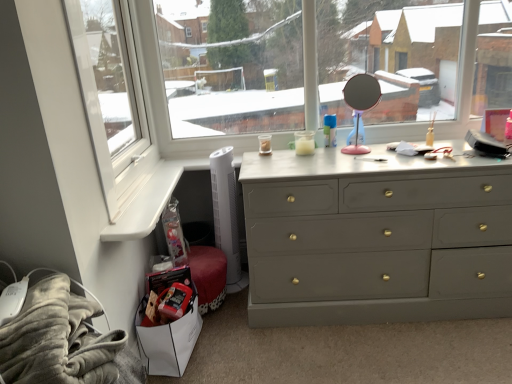
Question: Considering the relative sizes of matte gray dresser at center and fuzzy gray blanket at lower left in the image provided, is matte gray dresser at center shorter than fuzzy gray blanket at lower left?

Choices:
 (A) yes
 (B) no

Answer: (B)

Question: Is the depth of matte gray dresser at center greater than that of fuzzy gray blanket at lower left?

Choices:
 (A) yes
 (B) no

Answer: (A)

Question: From the image's perspective, is matte gray dresser at center over fuzzy gray blanket at lower left?

Choices:
 (A) no
 (B) yes

Answer: (B)

Question: Can we say matte gray dresser at center lies outside fuzzy gray blanket at lower left?

Choices:
 (A) yes
 (B) no

Answer: (A)

Question: Is matte gray dresser at center in contact with fuzzy gray blanket at lower left?

Choices:
 (A) yes
 (B) no

Answer: (B)

Question: Looking at the image, does matte gray dresser at center seem bigger or smaller compared to pink plastic mirror at upper center?

Choices:
 (A) big
 (B) small

Answer: (A)

Question: Does point (375, 256) appear closer or farther from the camera than point (380, 92)?

Choices:
 (A) farther
 (B) closer

Answer: (B)

Question: Is matte gray dresser at center situated inside pink plastic mirror at upper center or outside?

Choices:
 (A) inside
 (B) outside

Answer: (B)

Question: Considering the positions of matte gray dresser at center and pink plastic mirror at upper center in the image, is matte gray dresser at center wider or thinner than pink plastic mirror at upper center?

Choices:
 (A) wide
 (B) thin

Answer: (A)

Question: Would you say pink plastic mirror at upper center is inside or outside white plastic window frame at left?

Choices:
 (A) inside
 (B) outside

Answer: (B)

Question: Based on their sizes in the image, would you say pink plastic mirror at upper center is bigger or smaller than white plastic window frame at left?

Choices:
 (A) big
 (B) small

Answer: (B)

Question: Considering the relative positions of pink plastic mirror at upper center and white plastic window frame at left in the image provided, is pink plastic mirror at upper center to the left or to the right of white plastic window frame at left?

Choices:
 (A) right
 (B) left

Answer: (A)

Question: Is point (358, 86) positioned closer to the camera than point (106, 107)?

Choices:
 (A) farther
 (B) closer

Answer: (B)

Question: From their relative heights in the image, would you say fuzzy gray blanket at lower left is taller or shorter than pink plastic mirror at upper center?

Choices:
 (A) tall
 (B) short

Answer: (B)

Question: Considering the positions of fuzzy gray blanket at lower left and pink plastic mirror at upper center in the image, is fuzzy gray blanket at lower left wider or thinner than pink plastic mirror at upper center?

Choices:
 (A) thin
 (B) wide

Answer: (B)